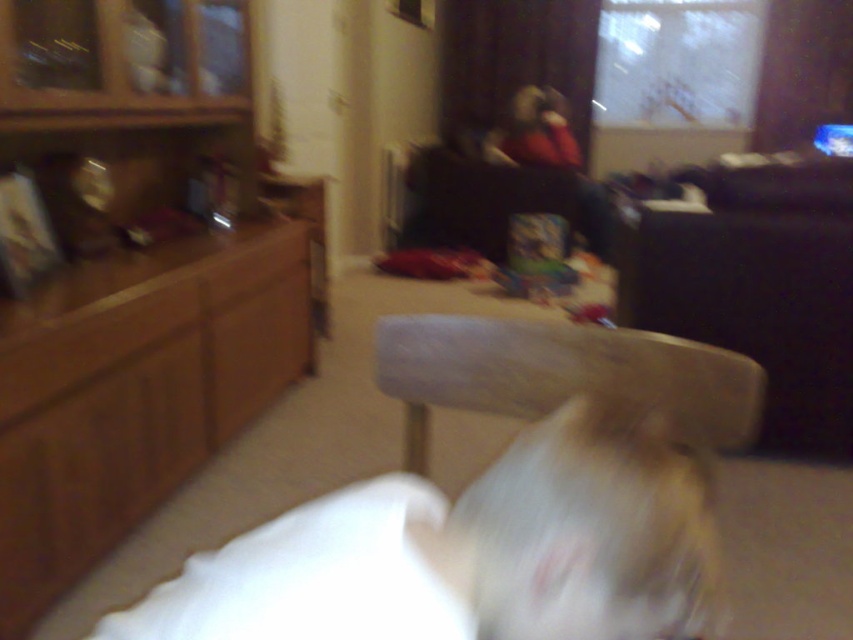
Looking at this image, you are standing in the living room and want to take a photo of the two points mentioned. Which point, point (207,132) or point (751,326), is closer to the camera?

Point (207,132) is further to the camera than point (751,326). Therefore, point (751,326) is closer to the camera.

You are a delivery person carrying a package that is 1.5 meters long. You need to place it between the brown wood dresser at left and the wooden stool at center. Is there enough space to fit the package between them?

The distance between the brown wood dresser at left and the wooden stool at center is 1.38 meters, which is shorter than the 1.5 meter package. Therefore, the package cannot fit between them.